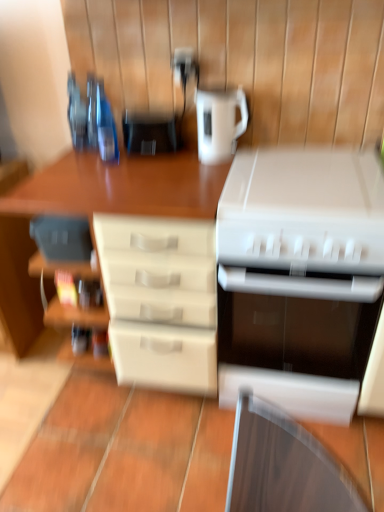
Question: Considering the positions of point (66, 153) and point (203, 102), is point (66, 153) closer or farther from the camera than point (203, 102)?

Choices:
 (A) farther
 (B) closer

Answer: (A)

Question: From the image's perspective, relative to white glossy kettle at upper center, the 1th kitchen appliance from the top, is matte white drawers at center above or below?

Choices:
 (A) above
 (B) below

Answer: (B)

Question: Which object is positioned farthest from the white plastic printer at center, which is the first appliance in bottom-to-top order?

Choices:
 (A) matte black coffee maker at center, which is counted as the first appliance, starting from the left
 (B) white plastic printer at center
 (C) white plastic printer at lower right, placed as the 1th kitchen appliance when sorted from bottom to top
 (D) white glossy kettle at upper center, the 1th kitchen appliance from the top
 (E) matte white drawers at center

Answer: (B)

Question: Estimate the real-world distances between objects in this image. Which object is closer to the white plastic printer at center, the second appliance viewed from the top?

Choices:
 (A) white plastic electric outlet at upper center
 (B) white glossy kettle at upper center, the 1th kitchen appliance from the top
 (C) matte white drawers at center
 (D) white plastic printer at center
 (E) matte black coffee maker at center, which appears as the 1th appliance when viewed from the top

Answer: (C)